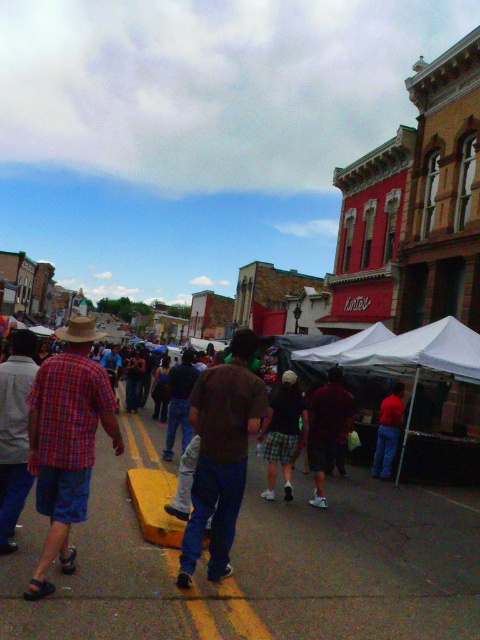
You are a street performer who needs to retrieve your brown straw cowboy hat at center from the ground where it fell. Your brown fabric skateboard at center is in the way. Can you reach the hat without moving the skateboard?

The brown fabric skateboard at center is 2.66 meters away from the brown straw cowboy hat at center, so you can easily reach the hat without moving the skateboard since the distance between them is sufficient.

You are standing at point (220, 454) in the street scene. What object is located exactly at your current position?

The brown fabric skateboard at center is located exactly at point (220, 454).

From the picture: You are a street performer who wants to show off your skateboard tricks. You have a brown fabric skateboard at center and a brown straw cowboy hat at center in your view. Which object is closer to you?

The brown fabric skateboard at center is closer to you since it is in front of the brown straw cowboy hat at center.